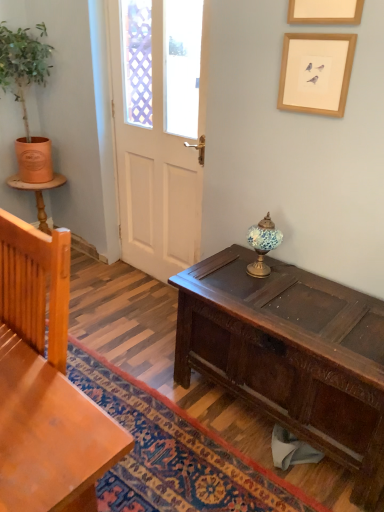
Identify the location of vacant space to the left of white matte door at center. (117, 281).